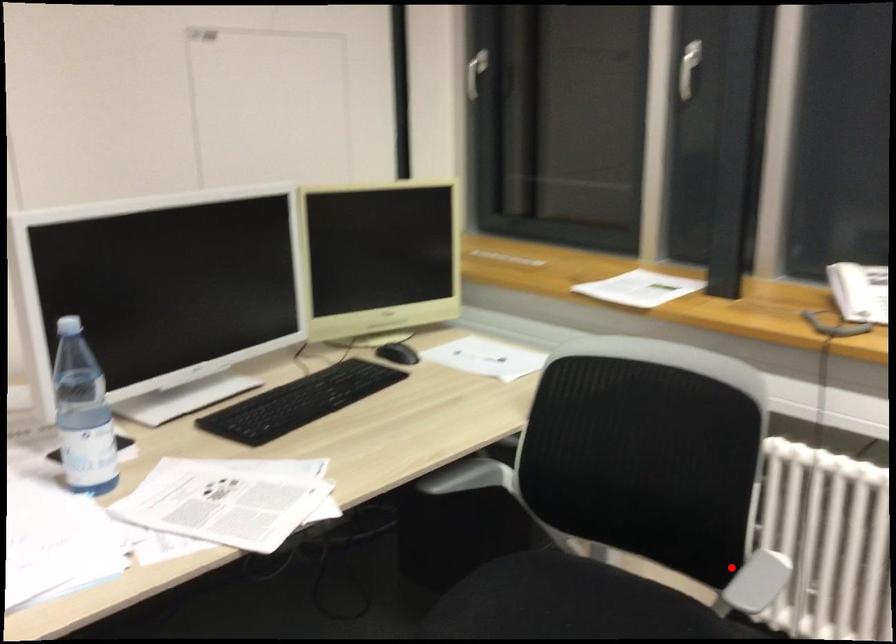
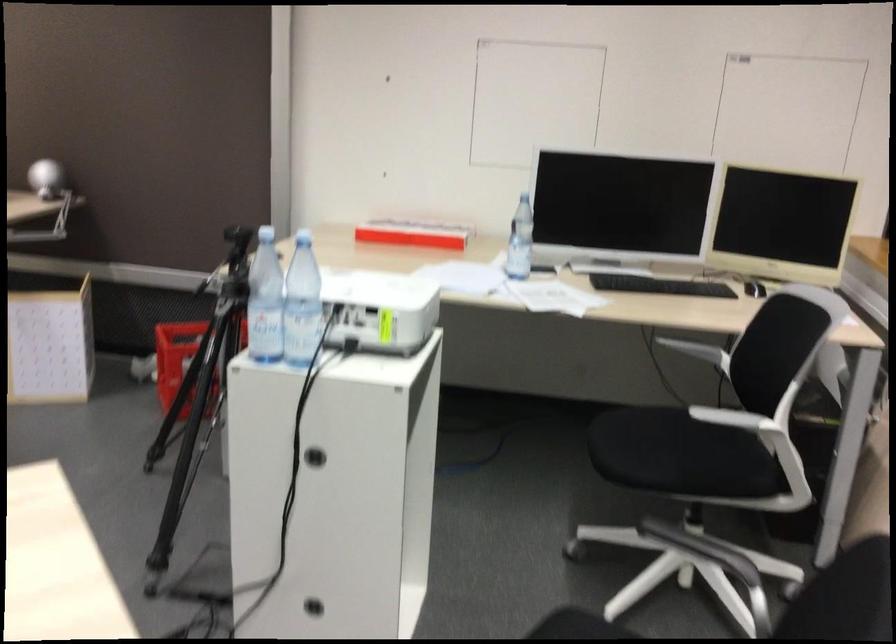
The point at the highlighted location is marked in the first image. Where is the corresponding point in the second image?

(733, 418)